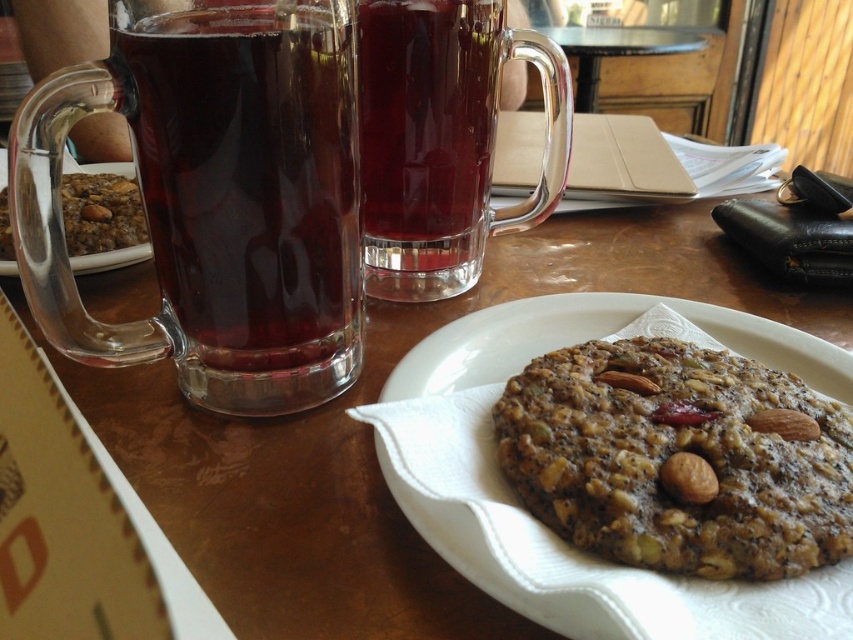
You are a barista preparing a drink and notice the transparent glass mug at upper left and the brown textured almond at center on the table. Which object would require more space to store if you need to place them side by side?

The transparent glass mug at upper left is bigger than the brown textured almond at center, so it would require more space to store when placing them side by side.

You are a customer at this cozy place and want to grab the transparent glass mug at left and the dark brown textured cookie at center. Based on their positions, which item would you need to reach over first?

The transparent glass mug at left is above the dark brown textured cookie at center, so you would need to reach for the transparent glass mug at left first to avoid obstructing the cookie below.

You are a customer sitting at the table and want to reach for the dark brown textured cookie at center. However, there is a transparent glass mug at left in your way. Can you easily grab the cookie without moving the mug?

The dark brown textured cookie at center is behind the transparent glass mug at left, so you can reach around the mug to grab the cookie without moving it.